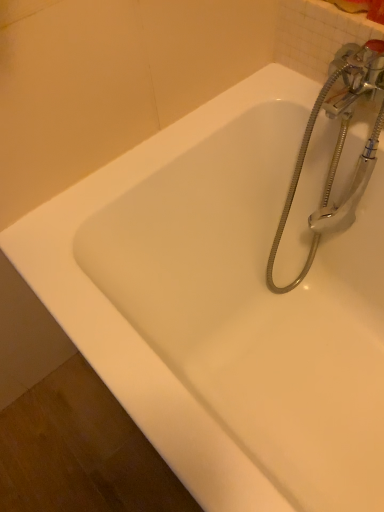
Measure the distance between chrome metallic shower head at upper right and camera.

The depth of chrome metallic shower head at upper right is 28.88 inches.

Locate an element on the screen. This screenshot has height=512, width=384. chrome metallic shower head at upper right is located at coordinates (338, 140).

Image resolution: width=384 pixels, height=512 pixels. Describe the element at coordinates (338, 140) in the screenshot. I see `chrome metallic shower head at upper right` at that location.

Find the location of a particular element. The width and height of the screenshot is (384, 512). chrome metallic shower head at upper right is located at coordinates (338, 140).